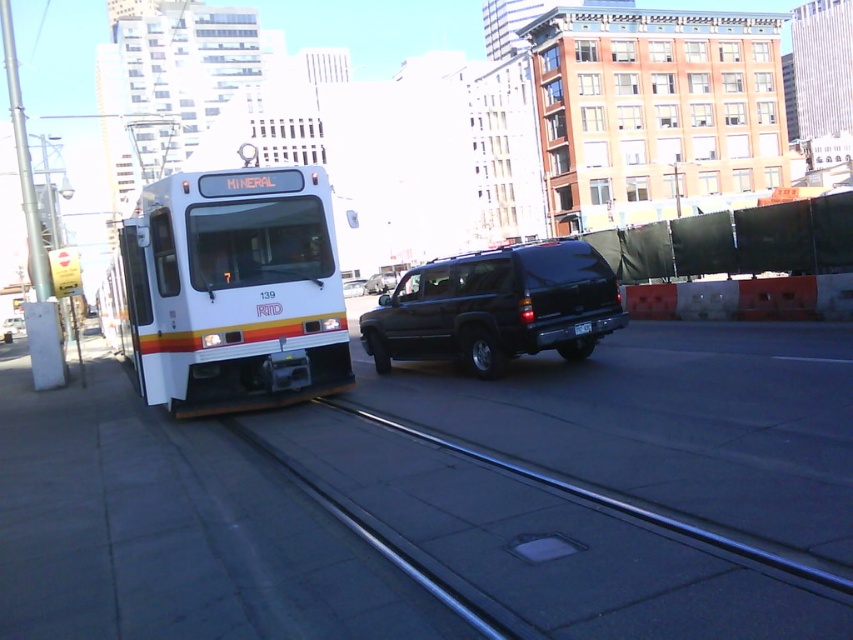
You are a pedestrian standing on the sidewalk observing the white matte bus at left and the satin black suv at center. Which vehicle is positioned higher from the ground?

The white matte bus at left is positioned higher from the ground than the satin black suv at center because it is located above the satin black suv at center.

You are a pedestrian standing at the sidewalk near the white matte bus at left. You need to cross the street to reach the satin black suv at center. The crosswalk is 40 meters long. Will you be able to cross the street before the vehicles move forward?

The white matte bus at left is 38.76 meters away from the satin black suv at center. Since the crosswalk is 40 meters long, the distance between the two vehicles is shorter than the crosswalk length. Therefore, you can safely cross the street before the vehicles move forward.

You are a passenger on the MINERAL LRV and want to know where the point marked at coordinates (538,540) is located. Based on the scene description, can you identify what this point is on?

The point marked at coordinates (538,540) is on the metallic rail at center.